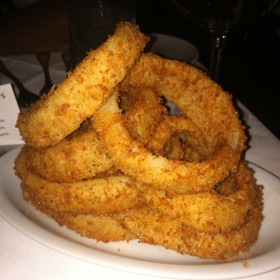
In order to click on plate in this screenshot , I will do `click(190, 273)`.